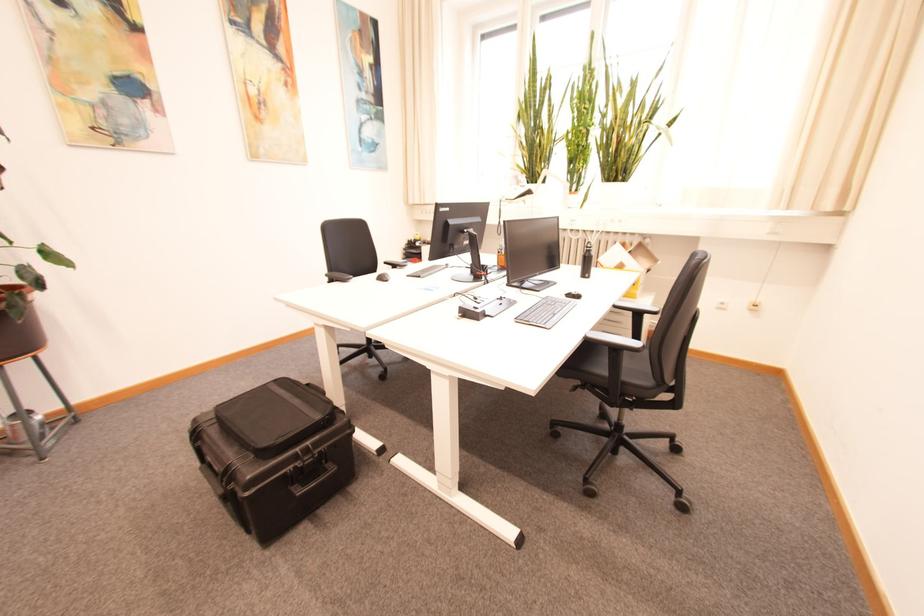
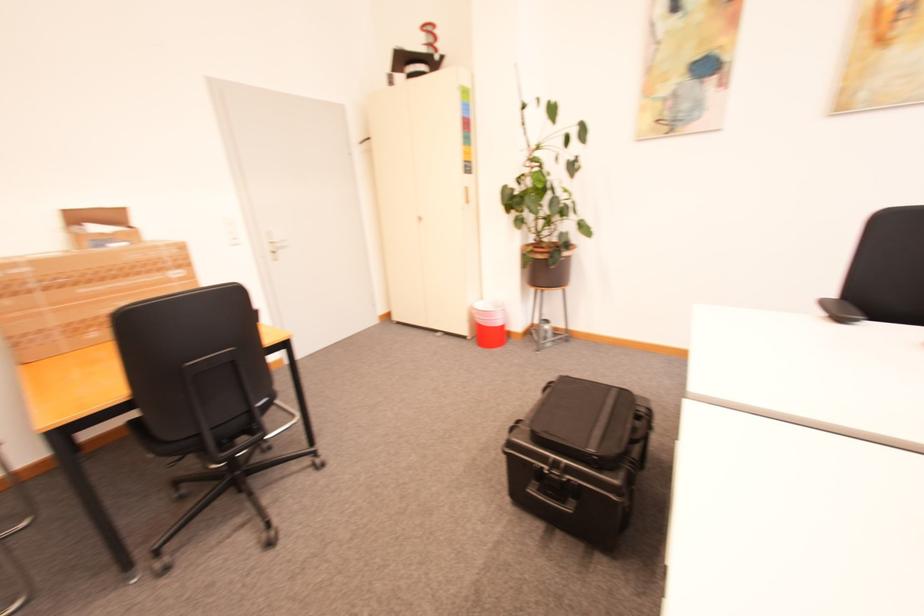
Locate, in the second image, the point that corresponds to pixel 319 445 in the first image.

(574, 467)